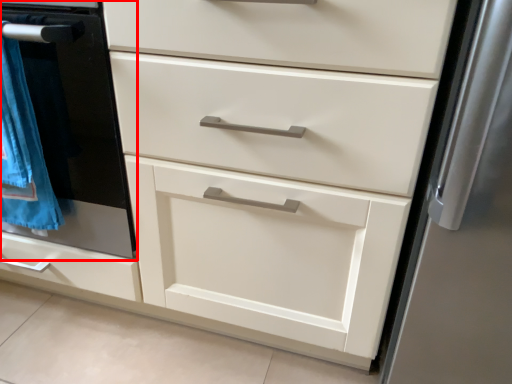
Question: From the image's perspective, what is the correct spatial positioning of oven (annotated by the red box) in reference to blanket?

Choices:
 (A) below
 (B) above

Answer: (B)